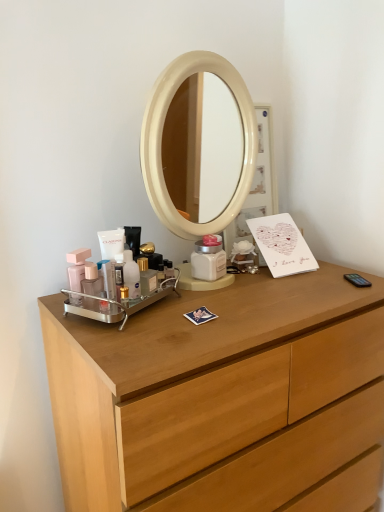
Identify the location of vacant space to the right of translucent plastic tube at center, which is counted as the third toiletry, starting from the left. (174, 313).